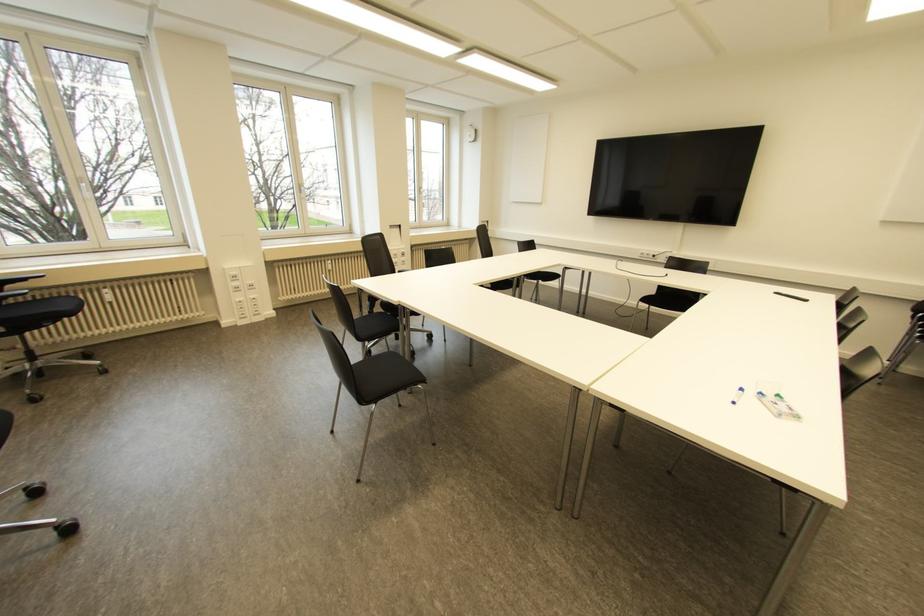
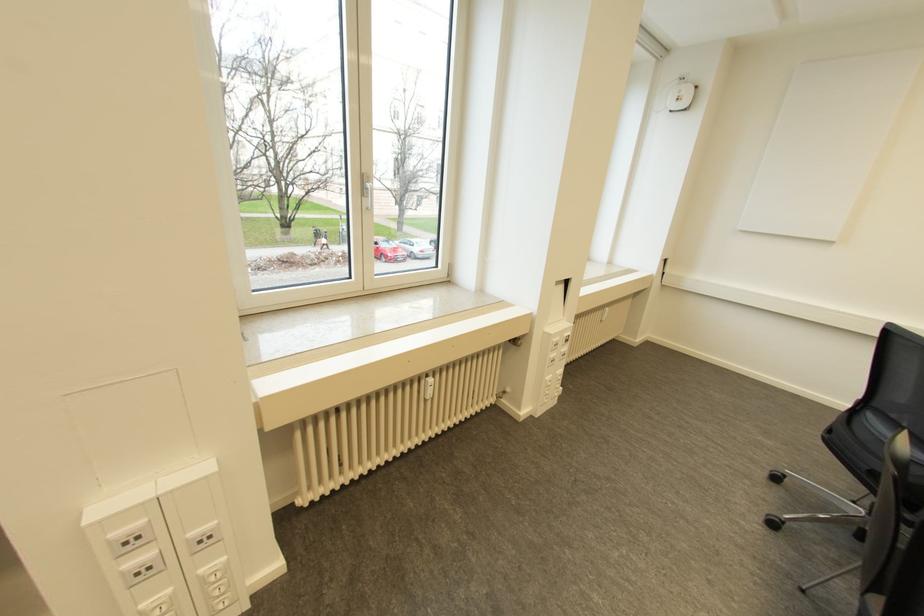
The point at (301, 195) is marked in the first image. Where is the corresponding point in the second image?

(366, 201)